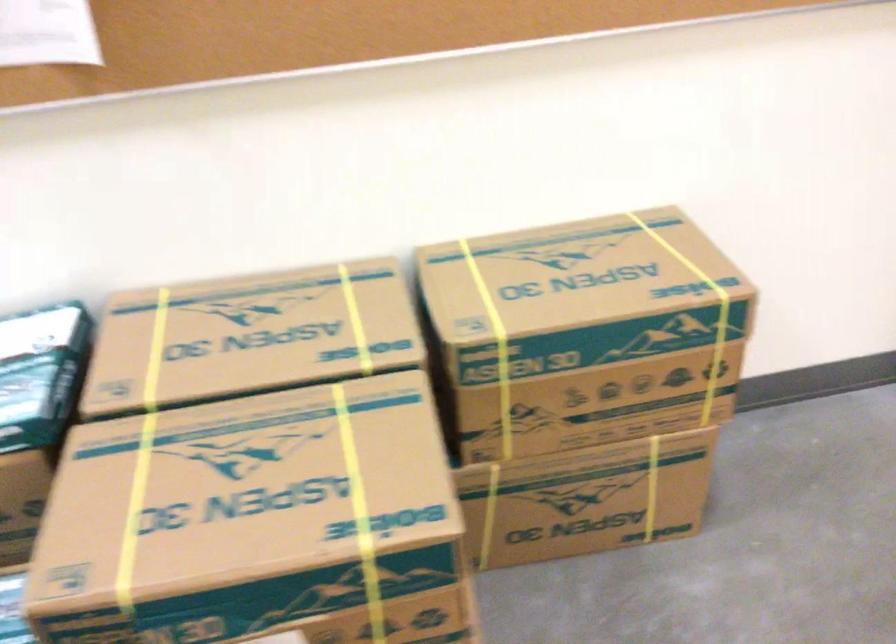
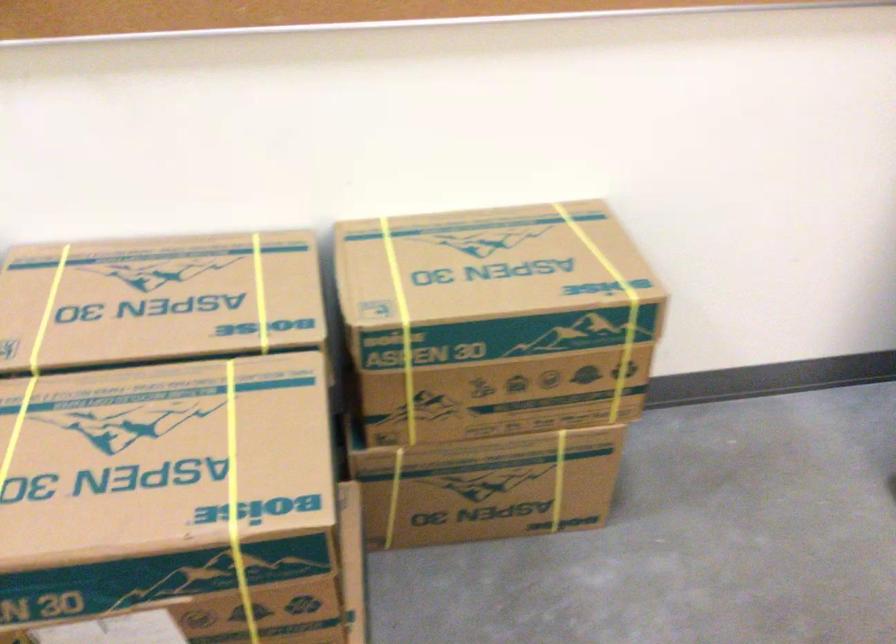
Where in the second image is the point corresponding to (495,343) from the first image?

(401, 327)